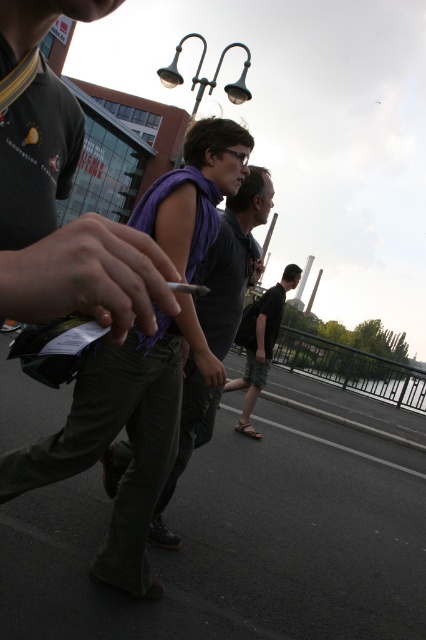
Question: Can you confirm if purple scarf at center is positioned below black matte cigarette at center?

Choices:
 (A) yes
 (B) no

Answer: (A)

Question: Which of these objects is positioned closest to the purple scarf at center?

Choices:
 (A) black matte cigarette at center
 (B) black cotton shorts at center

Answer: (A)

Question: Which of these objects is positioned farthest from the black cotton shorts at center?

Choices:
 (A) purple scarf at center
 (B) black matte cigarette at center

Answer: (B)

Question: Does purple scarf at center have a smaller size compared to black matte cigarette at center?

Choices:
 (A) no
 (B) yes

Answer: (A)

Question: Can you confirm if black cotton shorts at center is bigger than black matte cigarette at center?

Choices:
 (A) no
 (B) yes

Answer: (B)

Question: Which object is farther from the camera taking this photo?

Choices:
 (A) black cotton shorts at center
 (B) black matte cigarette at center

Answer: (A)